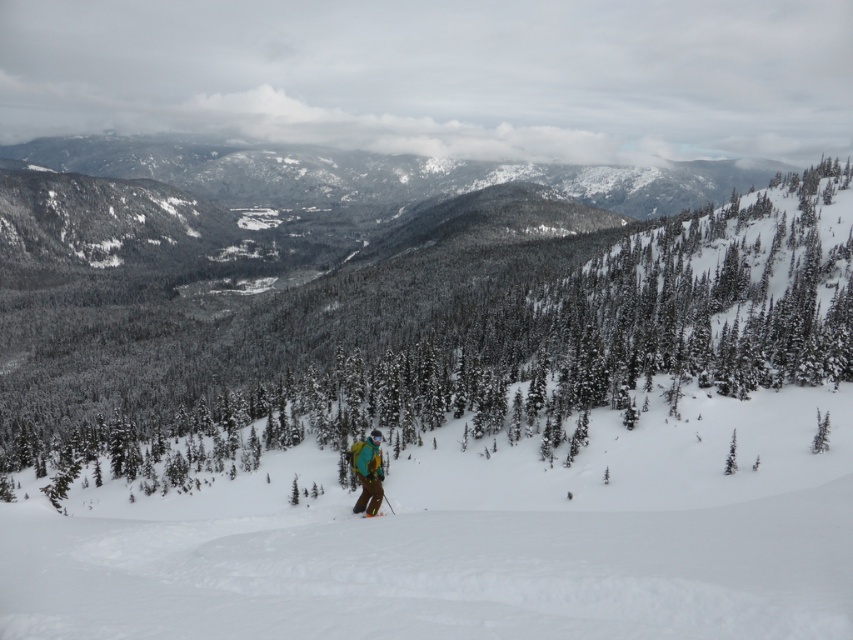
Consider the image. Does teal fabric jacket at center appear over orange metallic ski at center?

Yes, teal fabric jacket at center is above orange metallic ski at center.

Which of these two, teal fabric jacket at center or orange metallic ski at center, stands taller?

teal fabric jacket at center is taller.

At what (x,y) coordinates should I click in order to perform the action: click on teal fabric jacket at center. Please return your answer as a coordinate pair (x, y). Looking at the image, I should click on click(368, 474).

Is point (39, 579) positioned after point (360, 513)?

That is False.

Is white powder snow at center to the left of orange metallic ski at center from the viewer's perspective?

No, white powder snow at center is not to the left of orange metallic ski at center.

Which is in front, point (410, 550) or point (352, 508)?

Point (410, 550) is more forward.

The width and height of the screenshot is (853, 640). In order to click on white powder snow at center in this screenshot , I will do (x=436, y=572).

Does green matte tree at center come in front of teal fabric jacket at center?

No, green matte tree at center is further to the viewer.

Does point (262, 388) come in front of point (364, 444)?

No, it is not.

Who is more forward, [372,368] or [370,484]?

Positioned in front is point [370,484].

The image size is (853, 640). In order to click on green matte tree at center in this screenshot , I will do `click(450, 340)`.